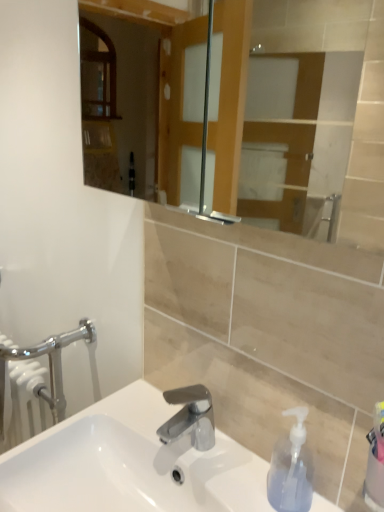
At what (x,y) coordinates should I click in order to perform the action: click on vacant space situated on the left part of transparent plastic soap dispenser at lower right. Please return your answer as a coordinate pair (x, y). Looking at the image, I should click on (221, 481).